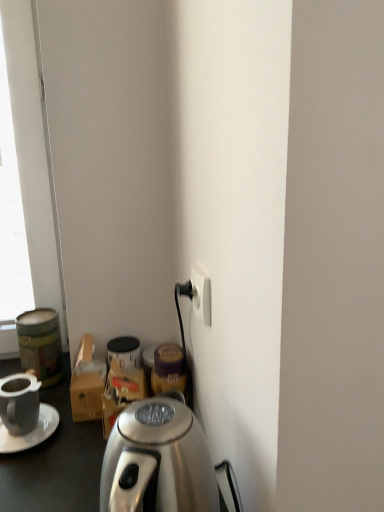
Question: From their relative heights in the image, would you say white plastic power outlet at lower right is taller or shorter than white matte saucer at left?

Choices:
 (A) tall
 (B) short

Answer: (A)

Question: Is white plastic power outlet at lower right inside or outside of white matte saucer at left?

Choices:
 (A) outside
 (B) inside

Answer: (A)

Question: Based on their relative distances, which object is nearer to the white matte saucer at left?

Choices:
 (A) white plastic power outlet at lower right
 (B) metallic green canister at left
 (C) matte black mug at lower left

Answer: (C)

Question: Which is nearer to the matte black mug at lower left?

Choices:
 (A) white matte saucer at left
 (B) metallic green canister at left
 (C) white plastic power outlet at lower right

Answer: (A)